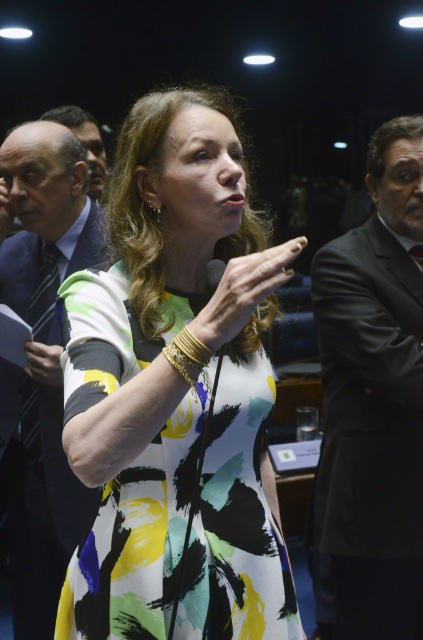
You are an event planner organizing a presentation. You need to ensure that the speaker can move freely while addressing the audience. Considering the printed fabric dress at center and the smooth skin hand at center, which object is taller and might require more vertical space?

The printed fabric dress at center is taller than the smooth skin hand at center, so it requires more vertical space.

Based on the photo, you are a photographer adjusting your camera settings to focus on two points in the scene. The first point is point (32, 376) and the second is point (194, 362). Since the camera can only focus on one point at a time, which point should you choose to ensure the speaker is in focus?

Point (32, 376) is further to the camera than point (194, 362). To ensure the speaker is in focus, you should choose the point closer to the speaker. Since the speaker is likely at the front of the scene, the point further away from the camera would be behind her. Wait, this seems conflicting. Let me think again. If the speaker is actively speaking into the microphone, she is probably at the front of the scene. The point further to the camera would be closer to the speaker. Therefore, to focus on her,